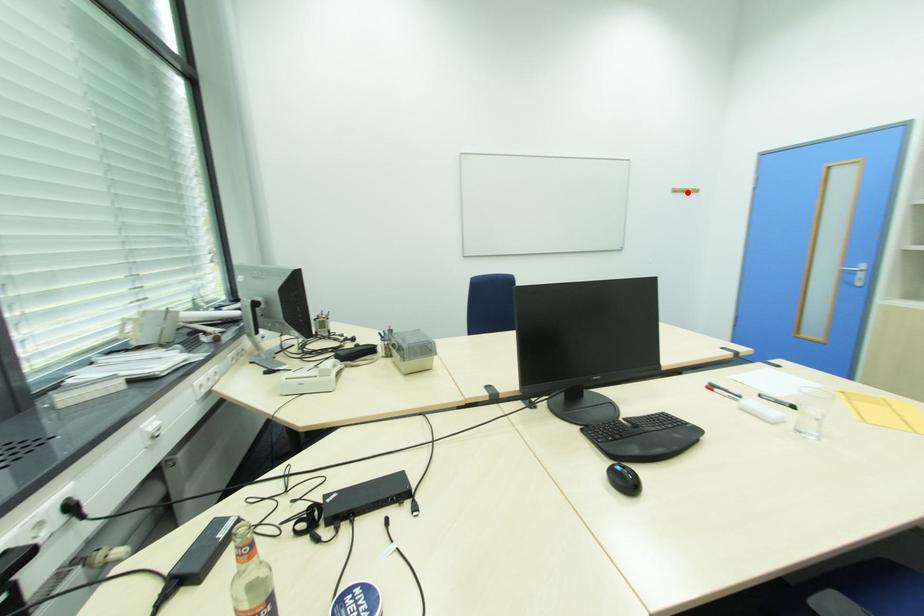
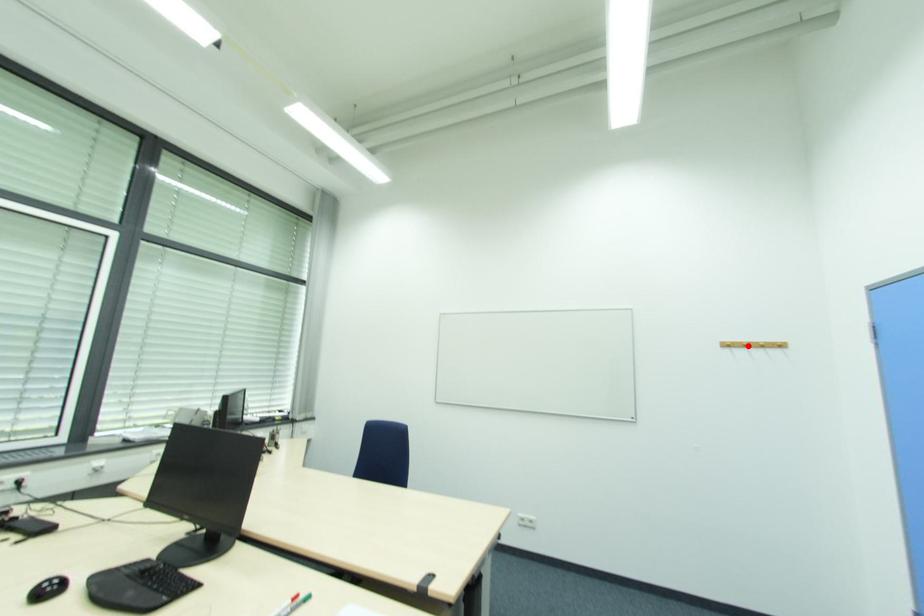
I am providing you with two images of the same scene from different viewpoints. A red point is marked on the first image and another point is marked on the second image. Is the red point in image1 aligned with the point shown in image2?

Yes